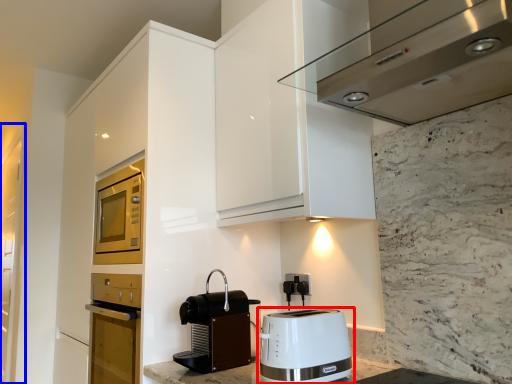
Question: Which object appears farthest to the camera in this image, toaster (highlighted by a red box) or glass door (highlighted by a blue box)?

Choices:
 (A) toaster
 (B) glass door

Answer: (B)